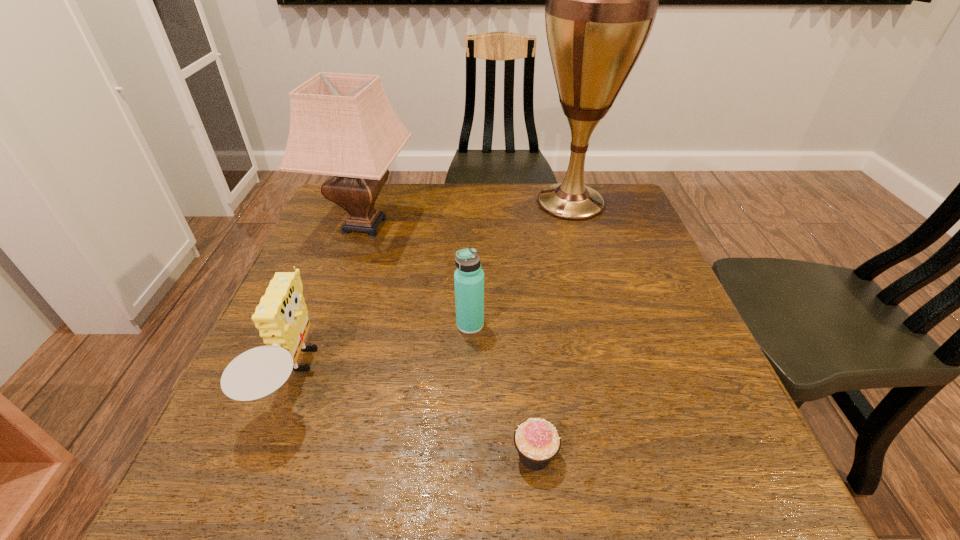
I want to click on vacant region between the third object from left to right and the rightmost object, so click(520, 264).

At what (x,y) coordinates should I click in order to perform the action: click on unoccupied position between the third object from right to left and the cupcake. Please return your answer as a coordinate pair (x, y). Looking at the image, I should click on (502, 390).

I want to click on vacant space that's between the lampshade and the shortest object, so click(450, 340).

Where is `vacant point located between the second object from right to left and the fourth shortest object`? vacant point located between the second object from right to left and the fourth shortest object is located at coordinates (450, 340).

The image size is (960, 540). Identify the location of free space between the shortest object and the thermos bottle. (502, 390).

You are a GUI agent. You are given a task and a screenshot of the screen. Output one action in this format:
    pyautogui.click(x=<x>, y=<y>)
    Task: Click on the free space that is in between the lampshade and the sponge
    
    Given the screenshot: What is the action you would take?
    pyautogui.click(x=330, y=301)

This screenshot has width=960, height=540. Find the location of `free space between the rightmost object and the sponge`. free space between the rightmost object and the sponge is located at coordinates (433, 289).

In order to click on object that stands as the third closest to the rightmost object in this screenshot , I will do `click(281, 317)`.

Select which object is the fourth closest to the thermos bottle. Please provide its 2D coordinates. Your answer should be formatted as a tuple, i.e. [(x, y)], where the tuple contains the x and y coordinates of a point satisfying the conditions above.

[(601, 2)]

Locate an element on the screen. The width and height of the screenshot is (960, 540). blank space that satisfies the following two spatial constraints: 1. on the front-facing side of the sponge; 2. on the back side of the second object from right to left is located at coordinates (265, 455).